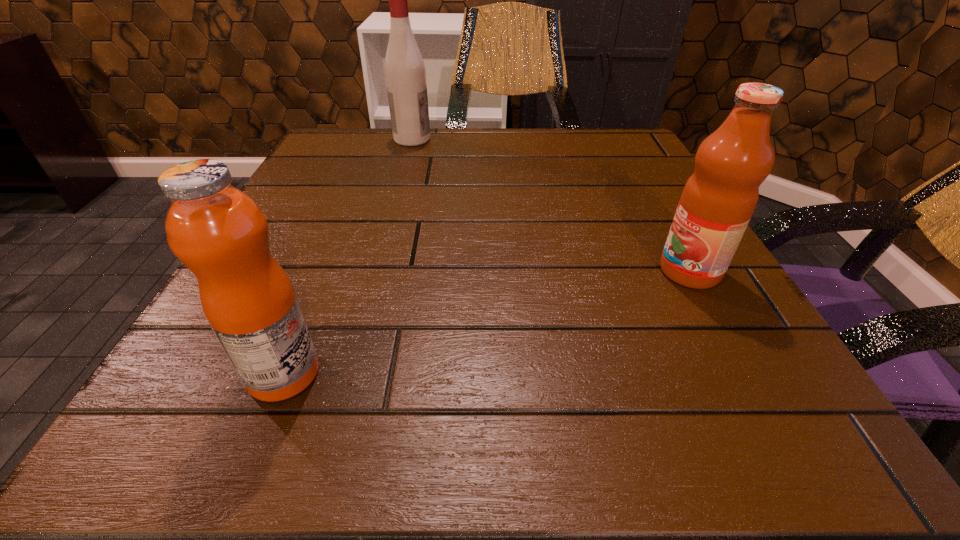
Where is `the tallest object`? The width and height of the screenshot is (960, 540). the tallest object is located at coordinates (405, 74).

At what (x,y) coordinates should I click in order to perform the action: click on alcohol. Please return your answer as a coordinate pair (x, y). Image resolution: width=960 pixels, height=540 pixels. Looking at the image, I should click on (405, 74).

The height and width of the screenshot is (540, 960). What are the coordinates of `the second farthest object` in the screenshot? It's located at (719, 198).

The height and width of the screenshot is (540, 960). Find the location of `the farther fruit juice`. the farther fruit juice is located at coordinates (719, 198).

Find the location of `the nearest object`. the nearest object is located at coordinates (218, 232).

Identify the location of the nearer fruit juice. Image resolution: width=960 pixels, height=540 pixels. (218, 232).

Locate an element on the screen. This screenshot has width=960, height=540. vacant region located 0.090m on the label of the tallest object is located at coordinates (470, 139).

Find the location of a particular element. The image size is (960, 540). blank space located 0.320m on the front label of the second nearest object is located at coordinates (445, 271).

The height and width of the screenshot is (540, 960). In order to click on free space located on the front label of the second nearest object in this screenshot , I will do coord(419,271).

What are the coordinates of `free space located 0.260m on the front label of the second nearest object` in the screenshot? It's located at (486, 271).